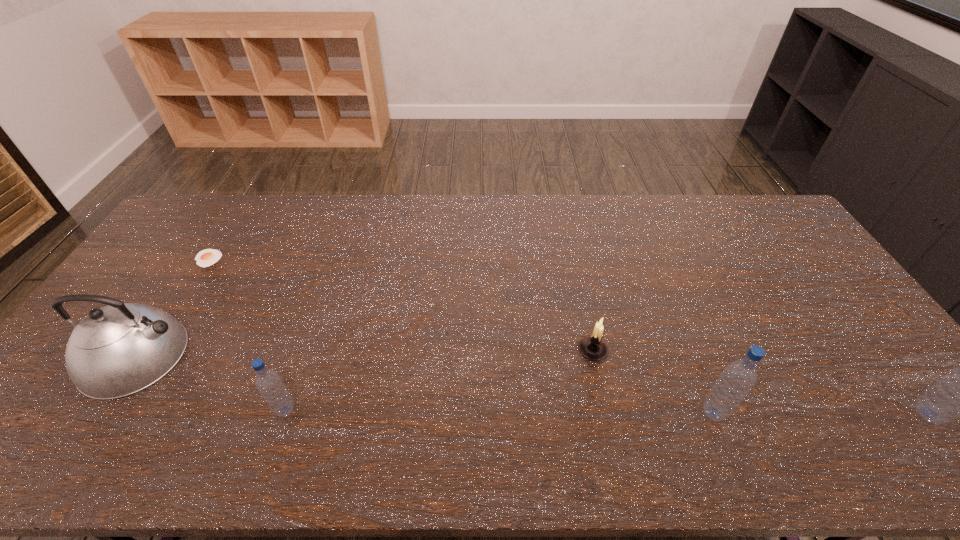
Where is `the fourth object from left to right`? This screenshot has width=960, height=540. the fourth object from left to right is located at coordinates pos(593,347).

Locate an element on the screen. This screenshot has height=540, width=960. vacant space situated 0.250m on the right of the shortest water bottle is located at coordinates (399, 410).

The height and width of the screenshot is (540, 960). What are the coordinates of `vacant region located on the right of the second tallest water bottle` in the screenshot? It's located at (802, 413).

This screenshot has width=960, height=540. In order to click on vacant space situated 0.230m on the back of the rightmost water bottle in this screenshot , I will do `click(860, 326)`.

Where is `vacant space situated 0.080m on the right of the egg yolk`? vacant space situated 0.080m on the right of the egg yolk is located at coordinates (246, 259).

Image resolution: width=960 pixels, height=540 pixels. Identify the location of vacant space located from the spout of the kettle. (334, 355).

Find the location of a particular element. This screenshot has width=960, height=540. free point located 0.280m on the back of the candle holder is located at coordinates (575, 268).

Where is `kettle that is at the near edge`? The height and width of the screenshot is (540, 960). kettle that is at the near edge is located at coordinates tap(117, 350).

The height and width of the screenshot is (540, 960). Find the location of `egg yolk at the left edge`. egg yolk at the left edge is located at coordinates (207, 257).

The height and width of the screenshot is (540, 960). Identify the location of kettle at the left edge. (117, 350).